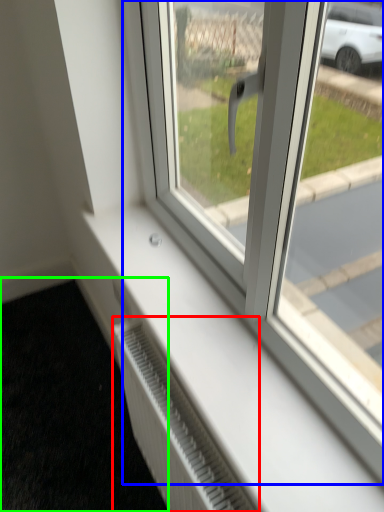
Question: Which object is positioned farthest from radiator (highlighted by a red box)? Select from window (highlighted by a blue box) and pavement (highlighted by a green box).

Choices:
 (A) window
 (B) pavement

Answer: (B)